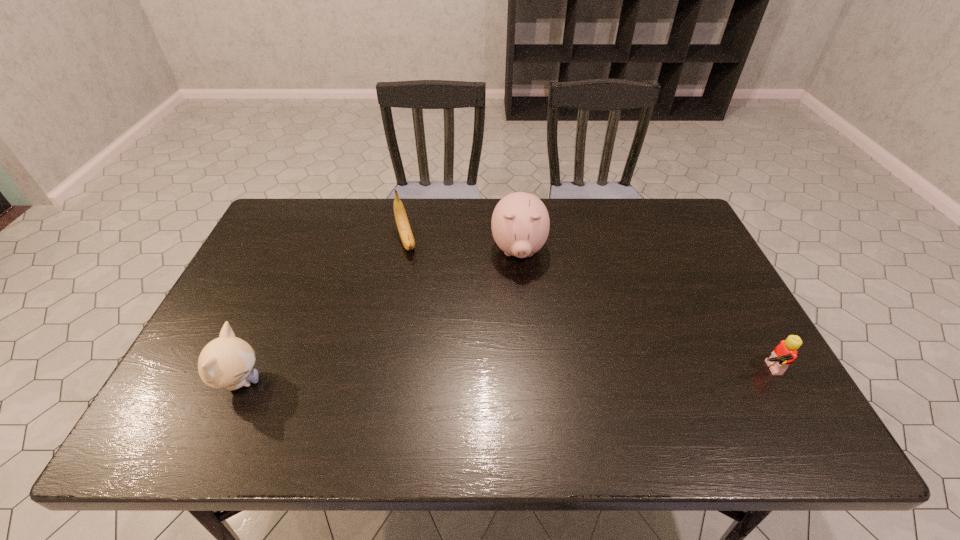
The image size is (960, 540). Find the location of `free space located 0.340m at the start of the peel on the banana`. free space located 0.340m at the start of the peel on the banana is located at coordinates (438, 342).

Locate an element on the screen. The height and width of the screenshot is (540, 960). vacant space situated 0.050m at the start of the peel on the banana is located at coordinates (411, 268).

This screenshot has width=960, height=540. Identify the location of piggy bank that is positioned at the far edge. (520, 224).

This screenshot has height=540, width=960. Find the location of `banana that is positioned at the far edge`. banana that is positioned at the far edge is located at coordinates (402, 222).

Image resolution: width=960 pixels, height=540 pixels. In order to click on kitten present at the near edge in this screenshot , I will do `click(226, 362)`.

This screenshot has height=540, width=960. Identify the location of Lego present at the near edge. (785, 353).

Locate an element on the screen. object that is at the left edge is located at coordinates (226, 362).

Where is `object located at the right edge`? The image size is (960, 540). object located at the right edge is located at coordinates (785, 353).

Where is `object located in the near left corner section of the desktop`? This screenshot has width=960, height=540. object located in the near left corner section of the desktop is located at coordinates (226, 362).

Find the location of a particular element. The height and width of the screenshot is (540, 960). object situated at the near right corner is located at coordinates (785, 353).